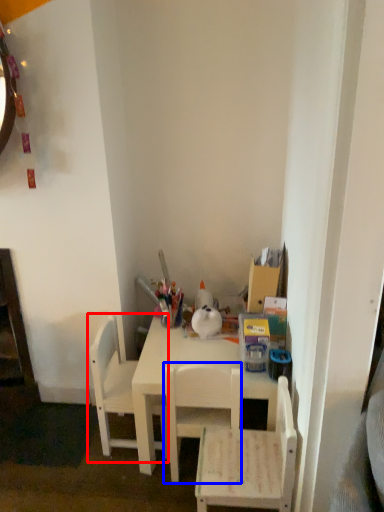
Question: Which object appears farthest to the camera in this image, chair (highlighted by a red box) or chair (highlighted by a blue box)?

Choices:
 (A) chair
 (B) chair

Answer: (A)